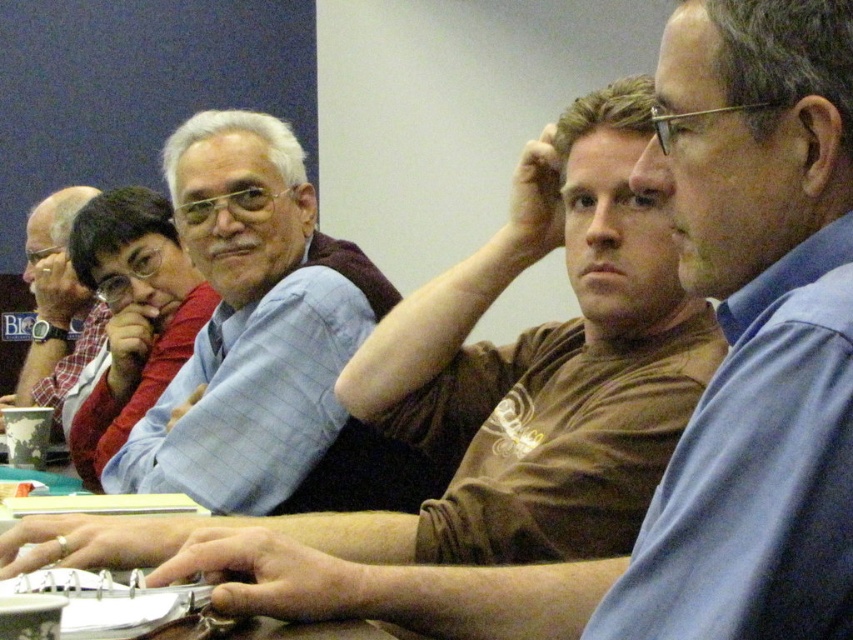
Question: Among these objects, which one is farthest from the camera?

Choices:
 (A) matte blue shirt at center
 (B) brown leather table at center
 (C) matte red sweater at center

Answer: (C)

Question: Estimate the real-world distances between objects in this image. Which object is farther from the matte blue shirt at center?

Choices:
 (A) matte red sweater at center
 (B) brown leather table at center
 (C) plaid shirt at left

Answer: (C)

Question: Is matte blue shirt at center above plaid shirt at left?

Choices:
 (A) no
 (B) yes

Answer: (A)

Question: Based on their relative distances, which object is farther from the brown leather table at center?

Choices:
 (A) matte red sweater at center
 (B) matte blue shirt at center

Answer: (A)

Question: Does matte red sweater at center have a lesser width compared to brown leather table at center?

Choices:
 (A) yes
 (B) no

Answer: (A)

Question: Is brown leather table at center smaller than plaid shirt at left?

Choices:
 (A) yes
 (B) no

Answer: (A)